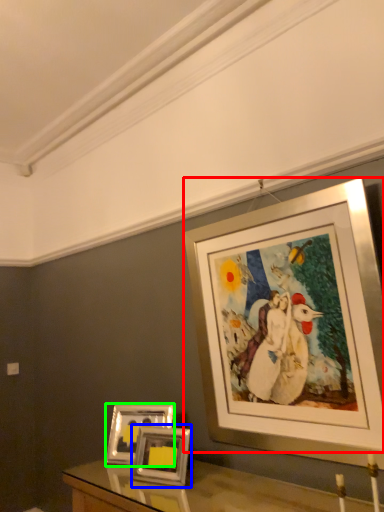
Question: Which object is the farthest from picture frame (highlighted by a red box)? Choose among these: picture frame (highlighted by a blue box) or picture frame (highlighted by a green box).

Choices:
 (A) picture frame
 (B) picture frame

Answer: (B)